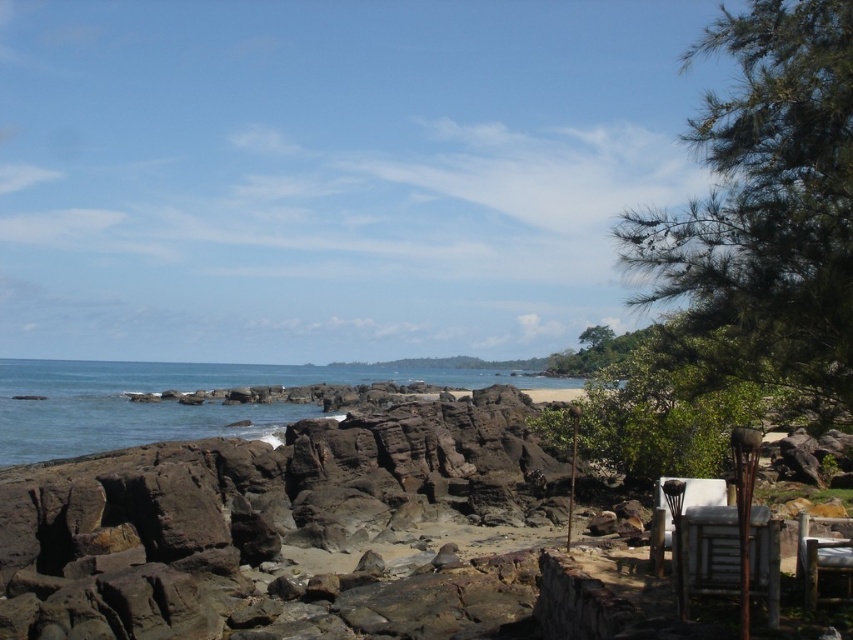
Question: Can you confirm if blue water at center is smaller than wooden chair at lower right?

Choices:
 (A) yes
 (B) no

Answer: (B)

Question: Which object is positioned closest to the wooden chair at lower right?

Choices:
 (A) white wooden chair at lower right
 (B) blue water at center

Answer: (A)

Question: Among these points, which one is farthest from the camera?

Choices:
 (A) (62, 380)
 (B) (849, 547)
 (C) (509, 483)
 (D) (747, 548)

Answer: (A)

Question: Is brown rock beach at center thinner than blue water at center?

Choices:
 (A) yes
 (B) no

Answer: (A)

Question: Can you confirm if brown rock beach at center is smaller than blue water at center?

Choices:
 (A) no
 (B) yes

Answer: (B)

Question: Among these points, which one is farthest from the camera?

Choices:
 (A) (515, 452)
 (B) (267, 371)

Answer: (B)